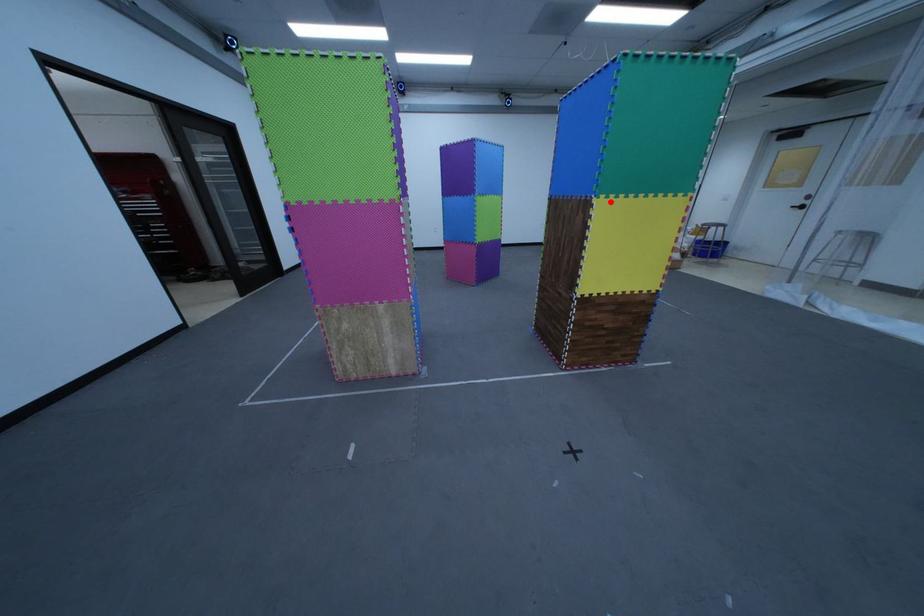
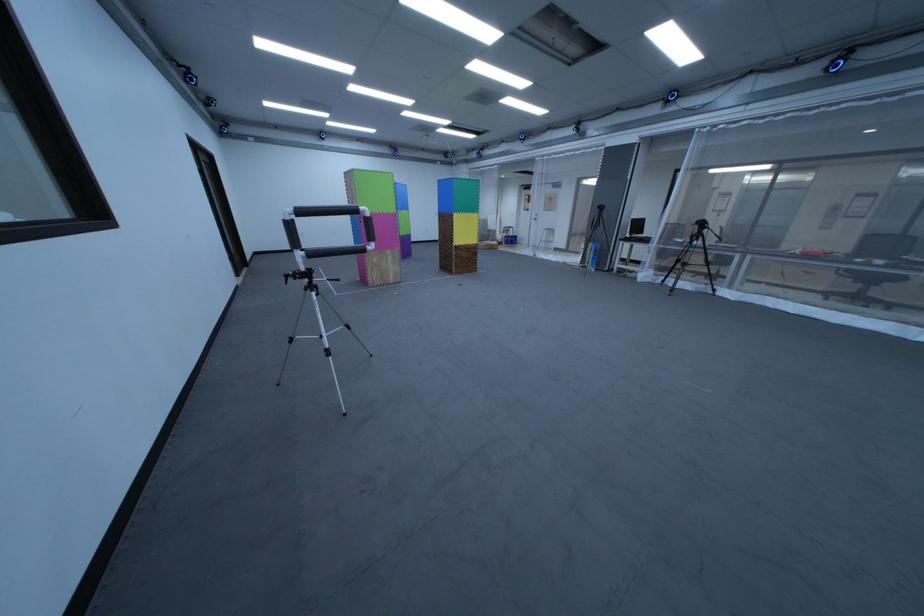
Question: A red point is marked in image1. In image2, is the corresponding 3D point closer to the camera or farther? Reply with the corresponding letter.

Choices:
 (A) The corresponding 3D point is closer.
 (B) The corresponding 3D point is farther.

Answer: (A)